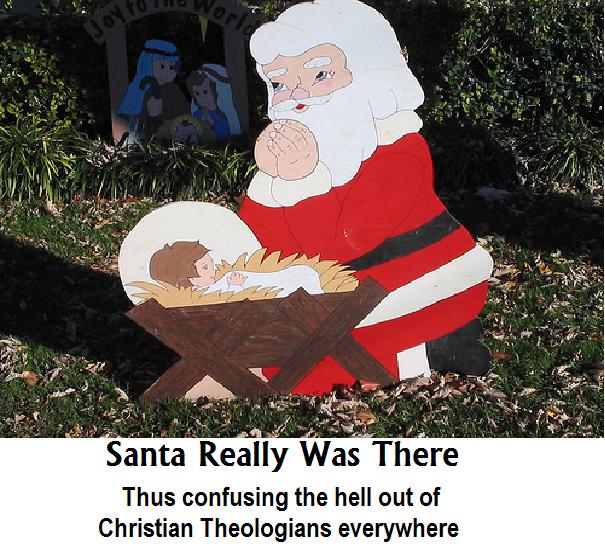
You are a GUI agent. You are given a task and a screenshot of the screen. Output one action in this format:
    pyautogui.click(x=<x>, y=<y>)
    Task: Click on the wood legs
    
    Given the screenshot: What is the action you would take?
    pyautogui.click(x=235, y=378), pyautogui.click(x=169, y=381), pyautogui.click(x=289, y=373), pyautogui.click(x=363, y=366)